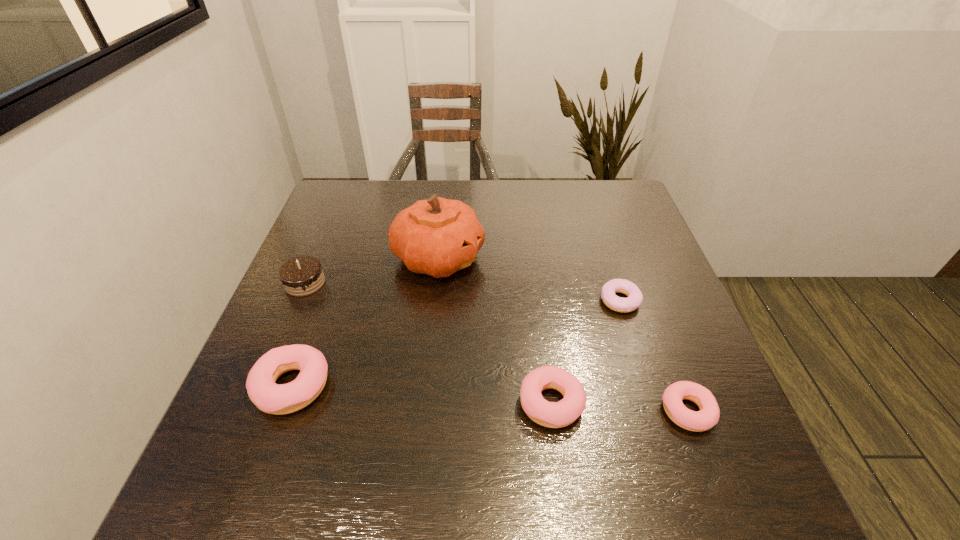
If equal spacing is the goal by inserting an additional doughnut among them, please point out a vacant space for this new doughnut. Please provide its 2D coordinates. Your answer should be formatted as a tuple, i.e. [(x, y)], where the tuple contains the x and y coordinates of a point satisfying the conditions above.

[(420, 395)]